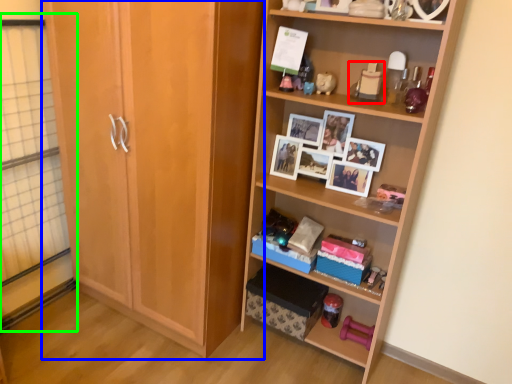
Question: Estimate the real-world distances between objects in this image. Which object is closer to toy (highlighted by a red box), cabinetry (highlighted by a blue box) or glass door (highlighted by a green box)?

Choices:
 (A) cabinetry
 (B) glass door

Answer: (A)